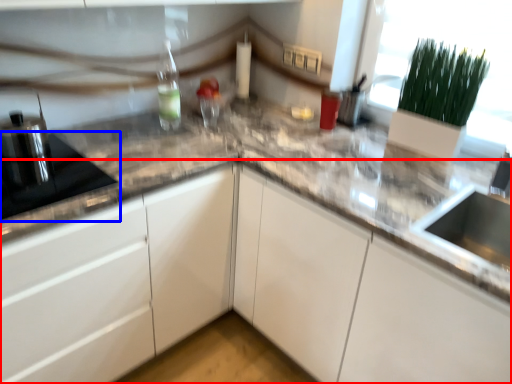
Question: Which object appears farthest to the camera in this image, cabinetry (highlighted by a red box) or appliance (highlighted by a blue box)?

Choices:
 (A) cabinetry
 (B) appliance

Answer: (B)